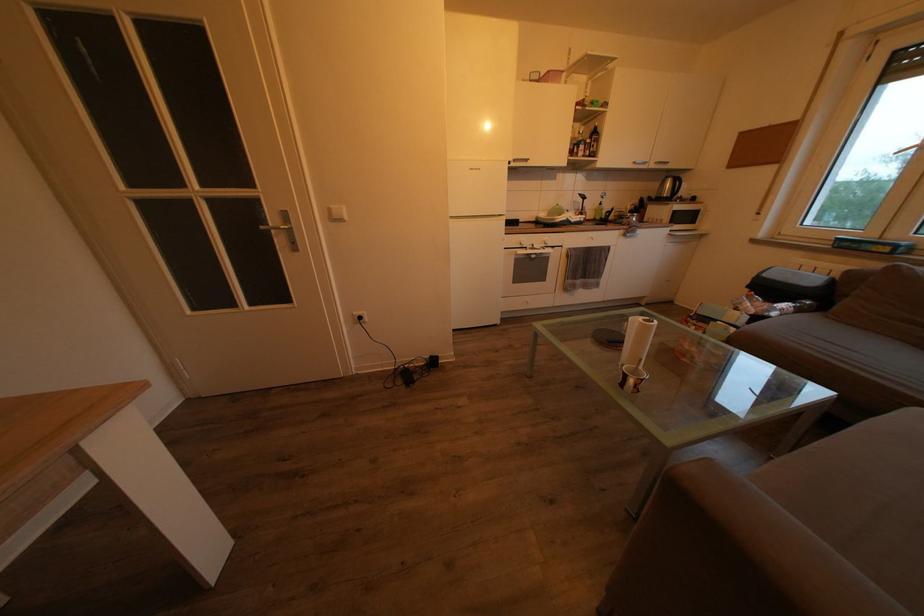
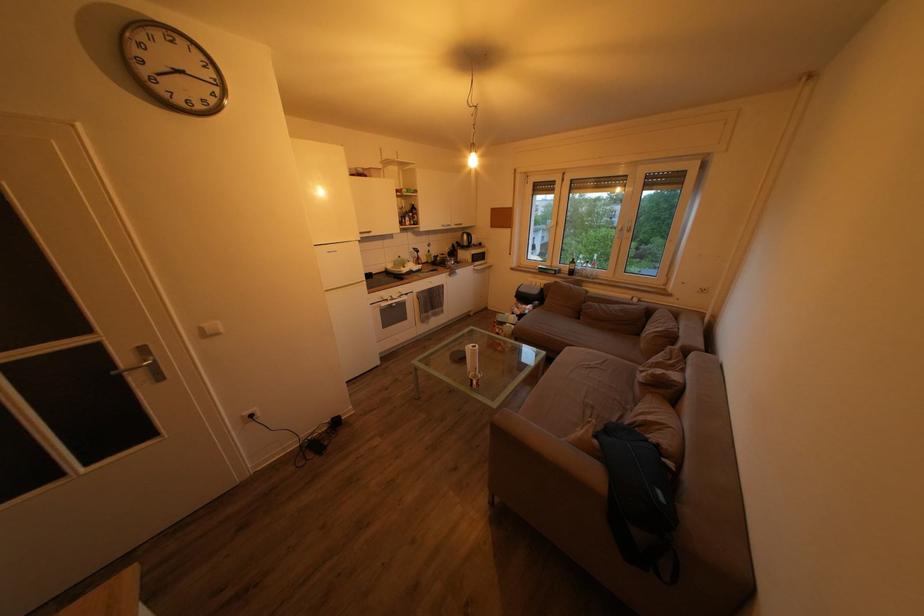
Find the pixel in the second image that matches pixel 660 172 in the first image.

(462, 233)